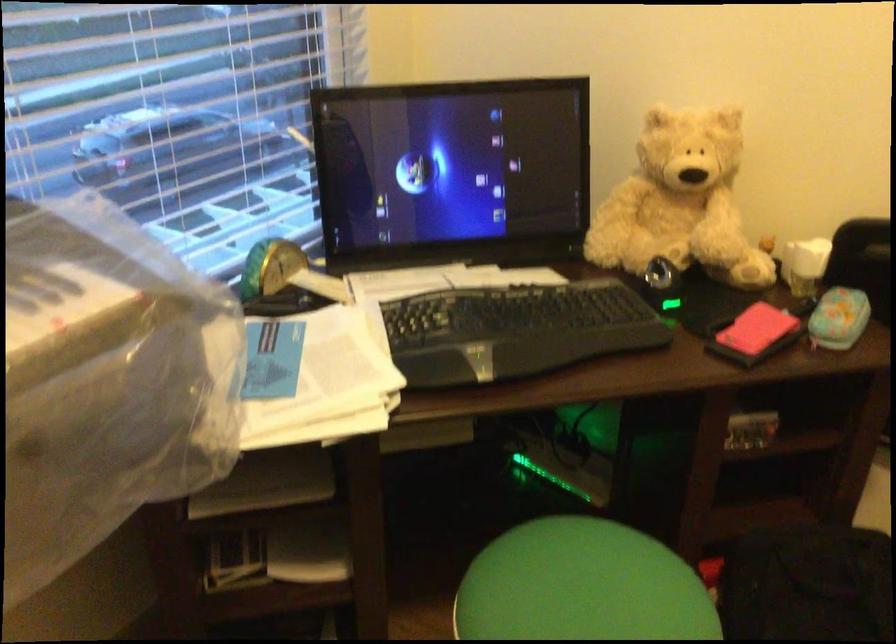
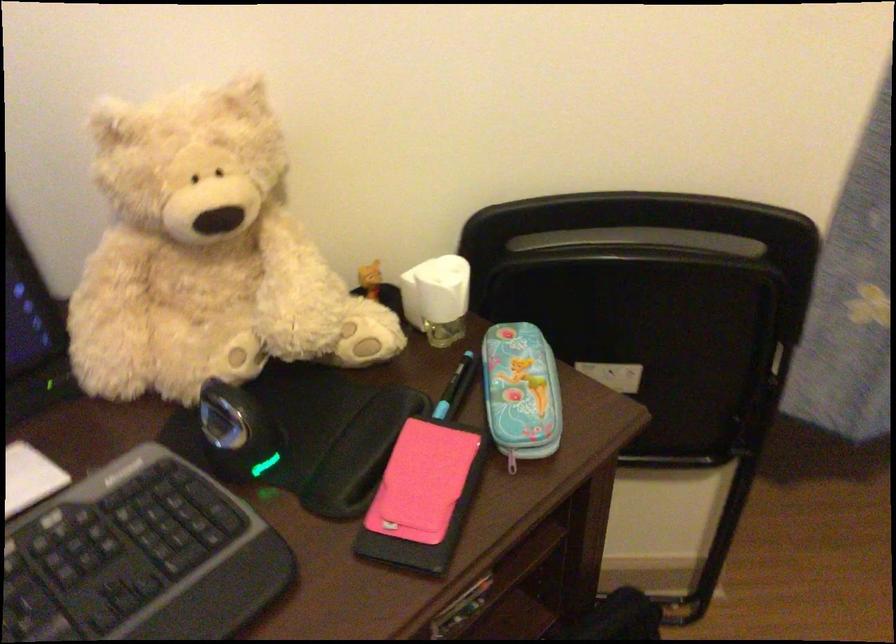
Find the pixel in the second image that matches point (804, 252) in the first image.

(437, 298)